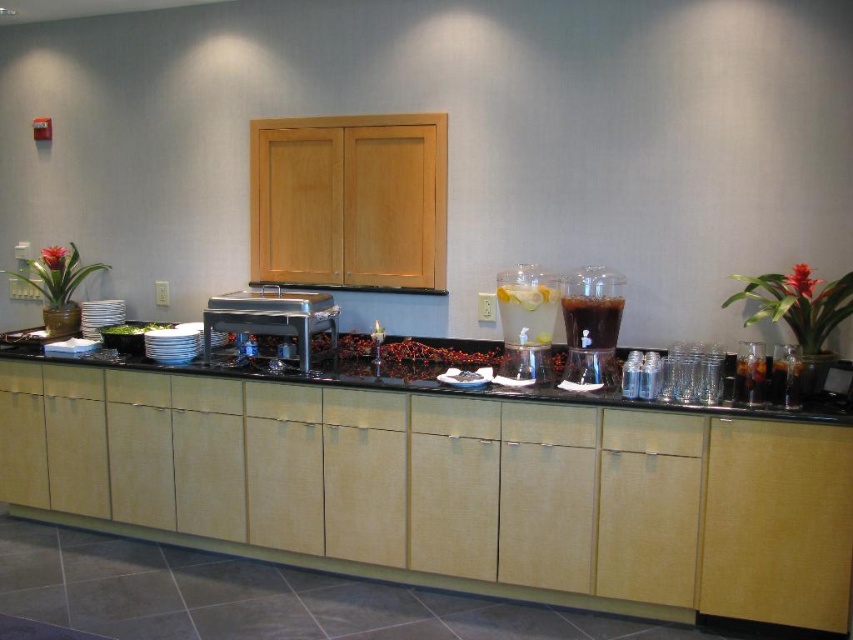
Question: Can you confirm if clear glass pitcher at center is smaller than white porcelain plates at center?

Choices:
 (A) no
 (B) yes

Answer: (A)

Question: From the image, what is the correct spatial relationship of transparent plastic blender at center in relation to dark translucent pitcher at center?

Choices:
 (A) above
 (B) below

Answer: (B)

Question: Which point appears farthest from the camera in this image?

Choices:
 (A) pos(584,333)
 (B) pos(500,369)
 (C) pos(555,314)
 (D) pos(467,352)

Answer: (D)

Question: Which point appears farthest from the camera in this image?

Choices:
 (A) (523, 364)
 (B) (614, 332)
 (C) (544, 394)

Answer: (A)

Question: Which of these objects is positioned closest to the black granite counter at center?

Choices:
 (A) dark translucent pitcher at center
 (B) white porcelain plates at center
 (C) transparent plastic blender at center

Answer: (C)

Question: Does black granite counter at center have a larger size compared to white porcelain plates at center?

Choices:
 (A) yes
 (B) no

Answer: (A)